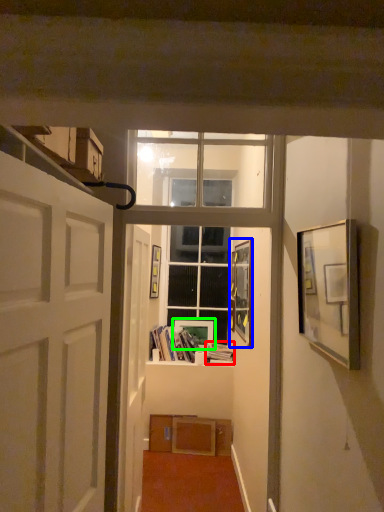
Question: Which object is positioned closest to book (highlighted by a red box)? Select from picture frame (highlighted by a blue box) and picture frame (highlighted by a green box).

Choices:
 (A) picture frame
 (B) picture frame

Answer: (B)